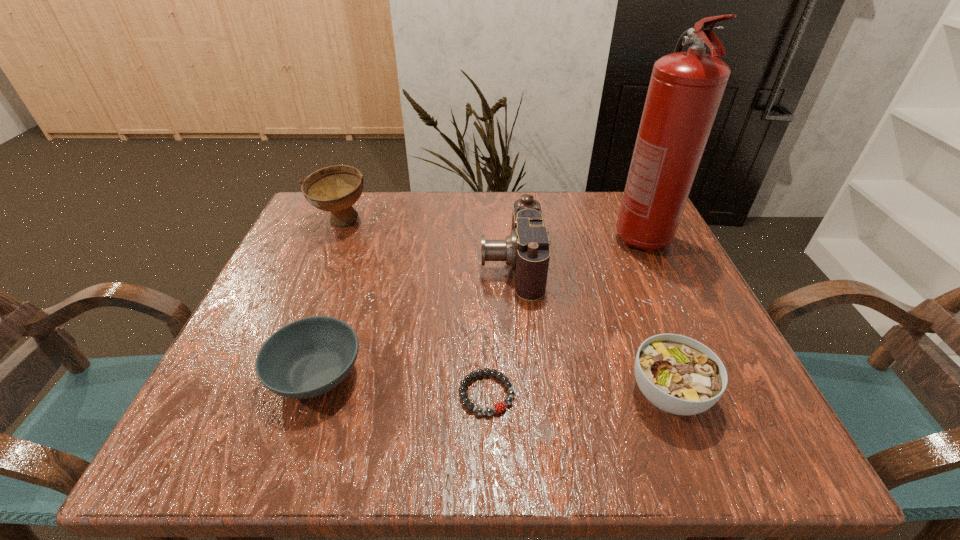
At what (x,y) coordinates should I click in order to perform the action: click on vacant area situated 0.310m on the front-facing side of the camera. Please return your answer as a coordinate pair (x, y). Looking at the image, I should click on (338, 264).

This screenshot has width=960, height=540. Find the location of `vacant space situated on the front-facing side of the camera`. vacant space situated on the front-facing side of the camera is located at coordinates (338, 264).

You are a GUI agent. You are given a task and a screenshot of the screen. Output one action in this format:
    pyautogui.click(x=<x>, y=<y>)
    Task: Click on the free point located 0.290m on the back of the fourth tallest object
    
    Given the screenshot: What is the action you would take?
    tap(617, 257)

Where is `vacant point located 0.370m on the back of the shortest soup bowl`? vacant point located 0.370m on the back of the shortest soup bowl is located at coordinates (368, 223).

The width and height of the screenshot is (960, 540). Identify the location of vacant space located 0.200m on the left of the shortest object. (334, 394).

Locate an element on the screen. The height and width of the screenshot is (540, 960). fire extinguisher present at the far edge is located at coordinates (686, 88).

Locate an element on the screen. This screenshot has height=540, width=960. soup bowl that is at the far edge is located at coordinates (334, 189).

Locate an element on the screen. This screenshot has width=960, height=540. camera that is at the far edge is located at coordinates (526, 250).

The height and width of the screenshot is (540, 960). I want to click on bracelet situated at the near edge, so click(498, 407).

The height and width of the screenshot is (540, 960). Find the location of `fire extinguisher located in the right edge section of the desktop`. fire extinguisher located in the right edge section of the desktop is located at coordinates (686, 88).